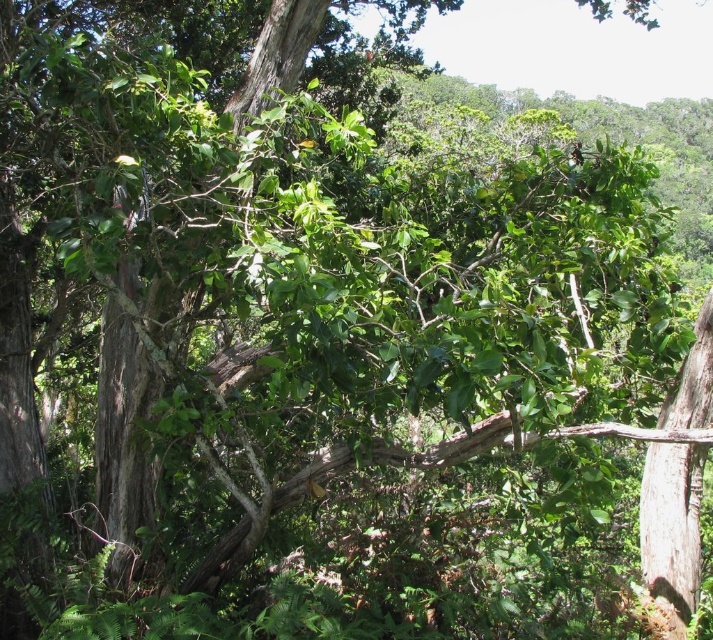
Question: Is the position of brown rough tree trunk at center more distant than that of smooth gray bark at right?

Choices:
 (A) no
 (B) yes

Answer: (A)

Question: Is brown rough tree trunk at center smaller than smooth gray bark at right?

Choices:
 (A) yes
 (B) no

Answer: (B)

Question: Which point is closer to the camera taking this photo?

Choices:
 (A) (118, 451)
 (B) (666, 456)

Answer: (B)

Question: Which point is closer to the camera?

Choices:
 (A) (662, 598)
 (B) (116, 333)

Answer: (A)

Question: Is brown rough tree trunk at center smaller than smooth gray bark at right?

Choices:
 (A) no
 (B) yes

Answer: (A)